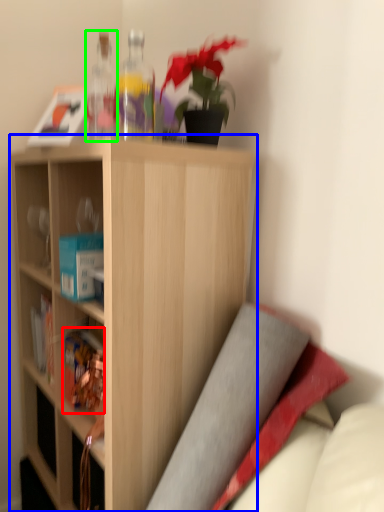
Question: Which object is positioned farthest from book (highlighted by a red box)? Select from shelf (highlighted by a blue box) and bottle (highlighted by a green box).

Choices:
 (A) shelf
 (B) bottle

Answer: (B)